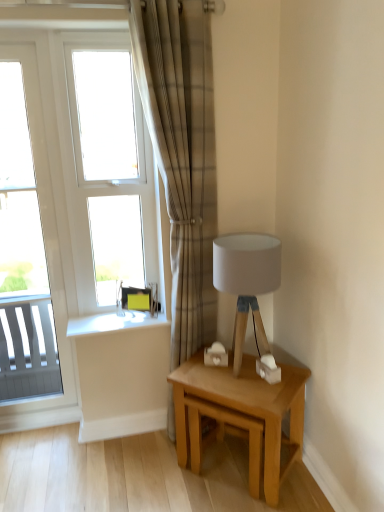
Question: Does point (117, 173) appear closer or farther from the camera than point (175, 240)?

Choices:
 (A) closer
 (B) farther

Answer: (B)

Question: Considering the positions of white glass window at upper left, which is the 1th window in right-to-left order, and plaid fabric curtain at center in the image, is white glass window at upper left, which is the 1th window in right-to-left order, wider or thinner than plaid fabric curtain at center?

Choices:
 (A) wide
 (B) thin

Answer: (B)

Question: Estimate the real-world distances between objects in this image. Which object is farther from the white glossy window at left, which is the second window in right-to-left order?

Choices:
 (A) white glass window at upper left, the second window when ordered from left to right
 (B) white fabric lampshade at upper right
 (C) plaid fabric curtain at center
 (D) light oak wooden table at lower right

Answer: (D)

Question: Which object is positioned farthest from the plaid fabric curtain at center?

Choices:
 (A) light oak wooden table at lower right
 (B) white glossy window at left, which is the second window in right-to-left order
 (C) white glass window at upper left, the second window when ordered from left to right
 (D) white fabric lampshade at upper right

Answer: (B)